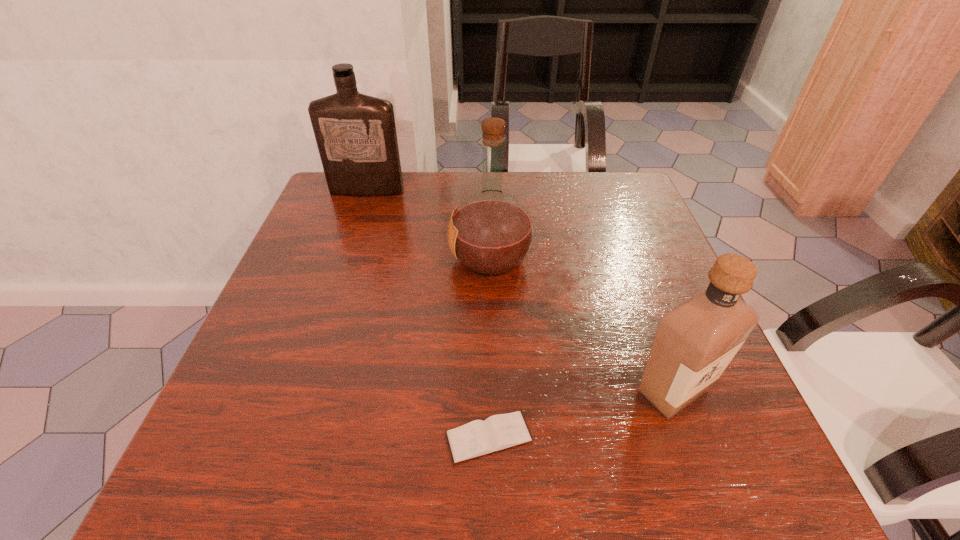
The image size is (960, 540). Find the location of `vacant space situated on the front label of the third nearest object`. vacant space situated on the front label of the third nearest object is located at coordinates (370, 258).

I want to click on vacant space located on the front-facing side of the rightmost liquor, so click(700, 463).

I want to click on vacant area situated 0.070m on the right of the shortest object, so click(578, 437).

Locate an element on the screen. The image size is (960, 540). object that is at the far edge is located at coordinates (355, 133).

Identify the location of object at the near edge. The width and height of the screenshot is (960, 540). (478, 438).

At what (x,y) coordinates should I click in order to perform the action: click on object that is at the left edge. Please return your answer as a coordinate pair (x, y). Looking at the image, I should click on coord(355,133).

Image resolution: width=960 pixels, height=540 pixels. I want to click on object positioned at the right edge, so click(x=694, y=342).

The height and width of the screenshot is (540, 960). What are the coordinates of `object present at the far left corner` in the screenshot? It's located at (355, 133).

You are a GUI agent. You are given a task and a screenshot of the screen. Output one action in this format:
    pyautogui.click(x=<x>, y=<y>)
    Task: Click on the vacant area at the far edge of the desktop
    
    Given the screenshot: What is the action you would take?
    pyautogui.click(x=387, y=198)

The width and height of the screenshot is (960, 540). In order to click on free space at the near edge of the desktop in this screenshot , I will do `click(615, 458)`.